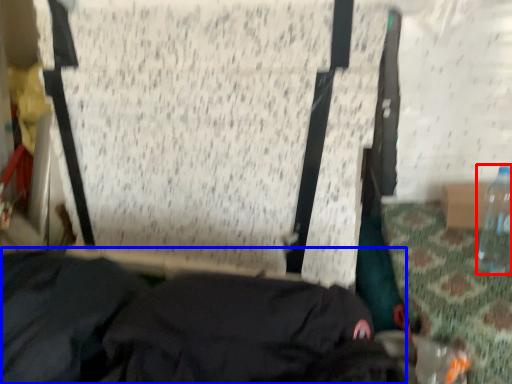
Question: Which object is further to the camera taking this photo, bottle (highlighted by a red box) or clothing (highlighted by a blue box)?

Choices:
 (A) bottle
 (B) clothing

Answer: (A)